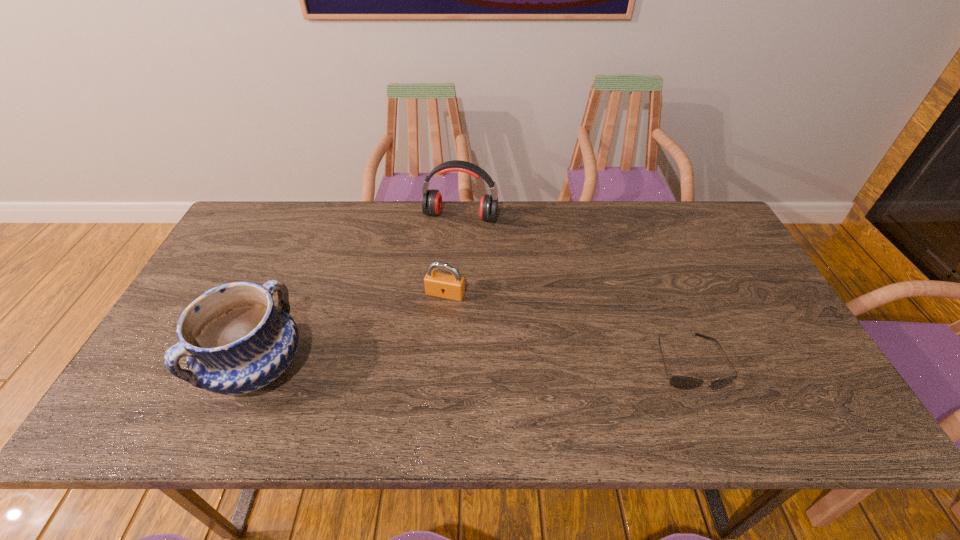
Image resolution: width=960 pixels, height=540 pixels. Find the location of `free space located on the ear cups of the farthest object`. free space located on the ear cups of the farthest object is located at coordinates pyautogui.click(x=443, y=262).

You are a GUI agent. You are given a task and a screenshot of the screen. Output one action in this format:
    pyautogui.click(x=<x>, y=<y>)
    Task: Click on the vacant space located on the ear cups of the farthest object
    The image size is (960, 540).
    Given the screenshot: What is the action you would take?
    click(x=430, y=302)

Find the location of a particular element. vacant space situated on the ear cups of the farthest object is located at coordinates (431, 299).

Locate an element on the screen. object that is at the far edge is located at coordinates coord(432,199).

The height and width of the screenshot is (540, 960). I want to click on pottery that is at the near edge, so click(x=236, y=341).

Where is `sunglasses at the near edge`? The height and width of the screenshot is (540, 960). sunglasses at the near edge is located at coordinates (681, 382).

Find the location of `object at the left edge`. object at the left edge is located at coordinates (236, 341).

What are the coordinates of `object present at the near left corner` in the screenshot? It's located at (236, 341).

At what (x,y) coordinates should I click in order to perform the action: click on free space at the far edge. Please return your answer as a coordinate pair (x, y). Looking at the image, I should click on (513, 217).

Locate an element on the screen. Image resolution: width=960 pixels, height=540 pixels. vacant space at the near edge of the desktop is located at coordinates (508, 381).